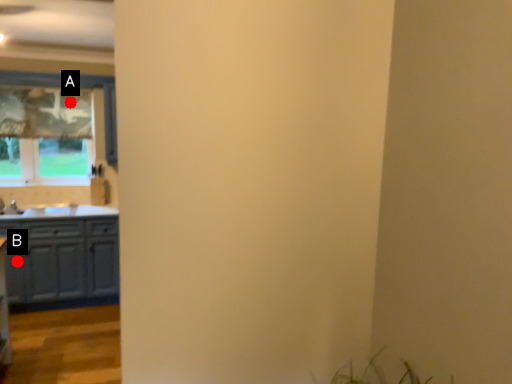
Question: Two points are circled on the image, labeled by A and B beside each circle. Among these points, which one is farthest from the camera?

Choices:
 (A) A is further
 (B) B is further

Answer: (A)